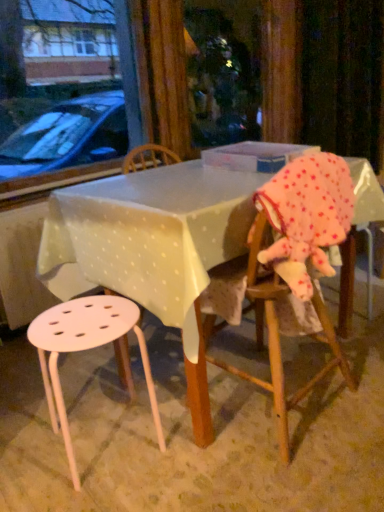
Question: Can you confirm if white plastic stool at lower left is smaller than white plastic table at center?

Choices:
 (A) yes
 (B) no

Answer: (A)

Question: Is white plastic stool at lower left further to camera compared to white plastic table at center?

Choices:
 (A) yes
 (B) no

Answer: (A)

Question: Is white plastic stool at lower left positioned before white plastic table at center?

Choices:
 (A) no
 (B) yes

Answer: (A)

Question: Is white plastic stool at lower left directly adjacent to white plastic table at center?

Choices:
 (A) yes
 (B) no

Answer: (B)

Question: From the image's perspective, is white plastic stool at lower left on white plastic table at center?

Choices:
 (A) yes
 (B) no

Answer: (B)

Question: Is point (39, 272) closer or farther from the camera than point (238, 146)?

Choices:
 (A) farther
 (B) closer

Answer: (B)

Question: Based on their positions, is white plastic table at center located to the left or right of translucent plastic box at center?

Choices:
 (A) right
 (B) left

Answer: (B)

Question: Would you say white plastic table at center is inside or outside translucent plastic box at center?

Choices:
 (A) outside
 (B) inside

Answer: (A)

Question: Is white plastic table at center taller or shorter than translucent plastic box at center?

Choices:
 (A) short
 (B) tall

Answer: (B)

Question: Visually, is white plastic stool at lower left positioned to the left or to the right of translucent plastic box at center?

Choices:
 (A) right
 (B) left

Answer: (B)

Question: From their relative heights in the image, would you say white plastic stool at lower left is taller or shorter than translucent plastic box at center?

Choices:
 (A) short
 (B) tall

Answer: (B)

Question: Looking at the image, does white plastic stool at lower left seem bigger or smaller compared to translucent plastic box at center?

Choices:
 (A) big
 (B) small

Answer: (A)

Question: Does point (145, 347) appear closer or farther from the camera than point (215, 159)?

Choices:
 (A) closer
 (B) farther

Answer: (B)

Question: Considering the relative positions of translucent plastic box at center and pink polka dot fabric at right in the image provided, is translucent plastic box at center to the left or to the right of pink polka dot fabric at right?

Choices:
 (A) right
 (B) left

Answer: (B)

Question: Considering the positions of translucent plastic box at center and pink polka dot fabric at right in the image, is translucent plastic box at center bigger or smaller than pink polka dot fabric at right?

Choices:
 (A) small
 (B) big

Answer: (A)